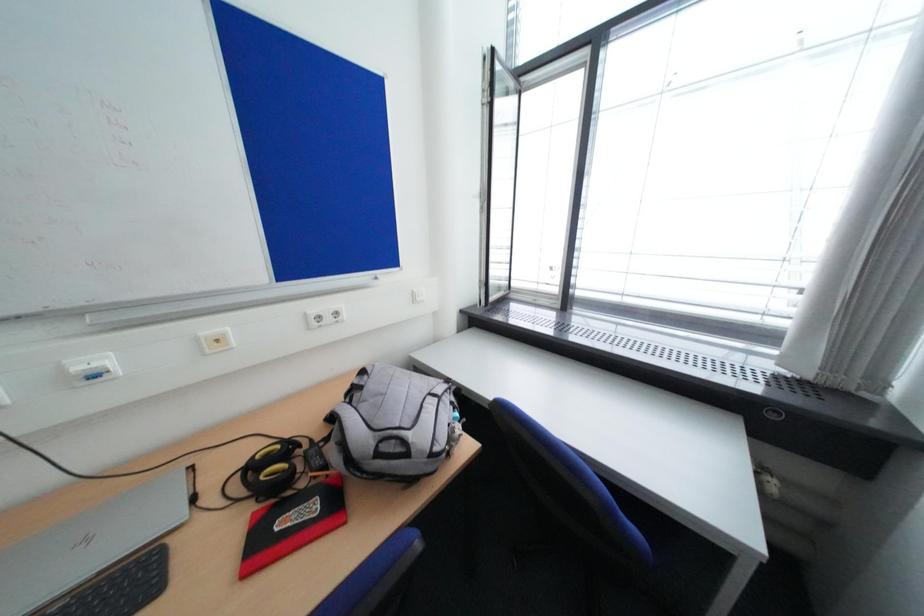
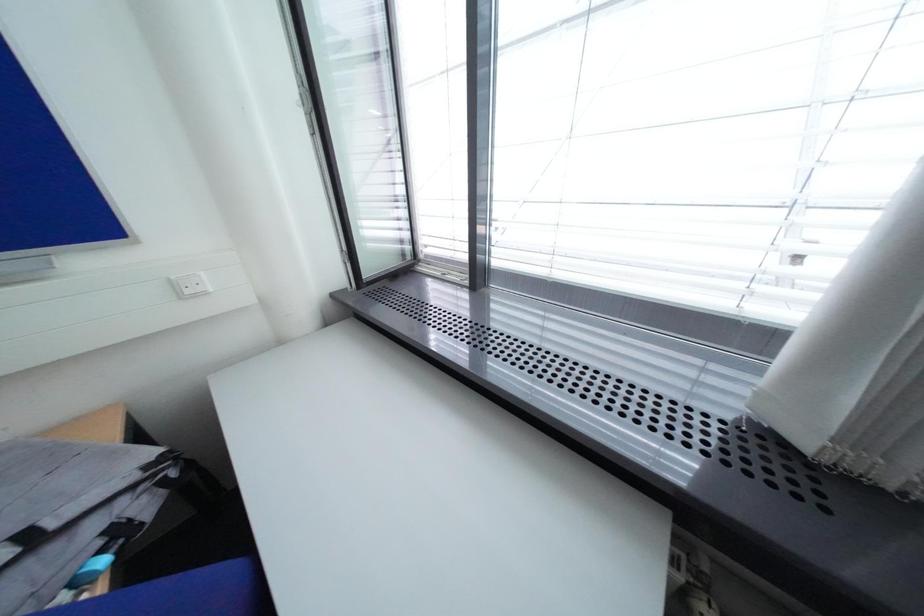
Which direction would the cameraman need to move to produce the second image?

The movement direction of the cameraman is right, forward.